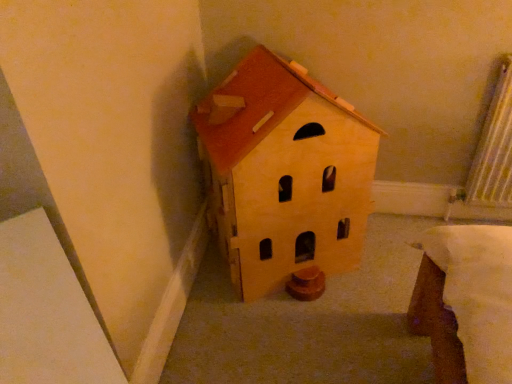
You are a GUI agent. You are given a task and a screenshot of the screen. Output one action in this format:
    pyautogui.click(x=<x>, y=<y>)
    Task: Click on the spots to the right of wooden house at center
    The height and width of the screenshot is (384, 512).
    Given the screenshot: What is the action you would take?
    pyautogui.click(x=389, y=260)